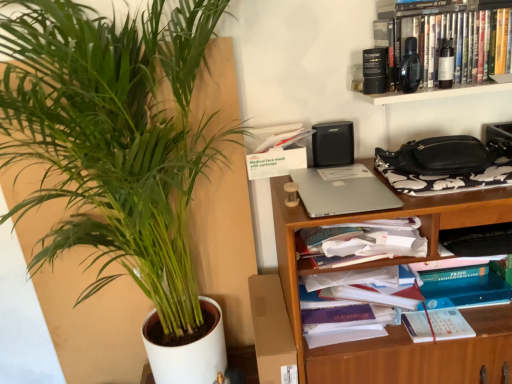
What are the coordinates of `silver metallic laptop at center-right` in the screenshot? It's located at (342, 191).

The width and height of the screenshot is (512, 384). Find the location of `green leafy plant at left`. green leafy plant at left is located at coordinates (114, 140).

At what (x,y) coordinates should I click in order to perform the action: click on black matte speaker at upper right. Please return your answer as a coordinate pair (x, y). Looking at the image, I should click on (333, 144).

From the image's perspective, relative to black plastic shelf at upper right, placed as the second shelf when sorted from bottom to top, is green leafy plant at left above or below?

green leafy plant at left is below black plastic shelf at upper right, placed as the second shelf when sorted from bottom to top.

How many degrees apart are the facing directions of green leafy plant at left and black plastic shelf at upper right, acting as the 1th shelf starting from the top?

There is a 5.04-degree angle between the facing directions of green leafy plant at left and black plastic shelf at upper right, acting as the 1th shelf starting from the top.

Is the depth of green leafy plant at left greater than that of black plastic shelf at upper right, acting as the 1th shelf starting from the top?

Yes, green leafy plant at left is behind black plastic shelf at upper right, acting as the 1th shelf starting from the top.

Based on the photo, between green leafy plant at left and black plastic shelf at upper right, placed as the second shelf when sorted from bottom to top, which one has less height?

black plastic shelf at upper right, placed as the second shelf when sorted from bottom to top.

Based on the photo, would you say black matte speaker at upper right is outside black plastic shelf at upper right, placed as the second shelf when sorted from bottom to top?

Absolutely, black matte speaker at upper right is external to black plastic shelf at upper right, placed as the second shelf when sorted from bottom to top.

From a real-world perspective, who is located lower, black matte speaker at upper right or black plastic shelf at upper right, acting as the 1th shelf starting from the top?

From a 3D spatial view, black matte speaker at upper right is below.

Who is shorter, black matte speaker at upper right or black plastic shelf at upper right, acting as the 1th shelf starting from the top?

Standing shorter between the two is black matte speaker at upper right.

Considering the sizes of objects black matte speaker at upper right and black plastic shelf at upper right, acting as the 1th shelf starting from the top, in the image provided, who is wider, black matte speaker at upper right or black plastic shelf at upper right, acting as the 1th shelf starting from the top,?

black plastic shelf at upper right, acting as the 1th shelf starting from the top.

Which is behind, black plastic shelf at upper right, placed as the second shelf when sorted from bottom to top, or green leafy plant at left?

green leafy plant at left.

Does black plastic shelf at upper right, placed as the second shelf when sorted from bottom to top, have a smaller size compared to green leafy plant at left?

Indeed, black plastic shelf at upper right, placed as the second shelf when sorted from bottom to top, has a smaller size compared to green leafy plant at left.

Is black plastic shelf at upper right, placed as the second shelf when sorted from bottom to top, completely or partially outside of green leafy plant at left?

Yes, black plastic shelf at upper right, placed as the second shelf when sorted from bottom to top, is outside of green leafy plant at left.

In the scene shown: Which object is positioned more to the left, black plastic shelf at upper right, acting as the 1th shelf starting from the top, or green leafy plant at left?

green leafy plant at left.

Is green leafy plant at left oriented towards silver metallic laptop at center-right?

No, green leafy plant at left is not aimed at silver metallic laptop at center-right.

From a real-world perspective, which is physically above, green leafy plant at left or silver metallic laptop at center-right?

From a 3D spatial view, silver metallic laptop at center-right is above.

Which object is wider, green leafy plant at left or silver metallic laptop at center-right?

silver metallic laptop at center-right is wider.

Measure the distance between green leafy plant at left and silver metallic laptop at center-right.

The distance of green leafy plant at left from silver metallic laptop at center-right is 20.48 inches.

From a real-world perspective, which is physically below, black matte speaker at upper right or wooden bookshelf at center-right, the 1th shelf in the bottom-to-top sequence?

wooden bookshelf at center-right, the 1th shelf in the bottom-to-top sequence, from a real-world perspective.

Considering the sizes of objects black matte speaker at upper right and wooden bookshelf at center-right, marked as the second shelf in a top-to-bottom arrangement, in the image provided, who is taller, black matte speaker at upper right or wooden bookshelf at center-right, marked as the second shelf in a top-to-bottom arrangement,?

wooden bookshelf at center-right, marked as the second shelf in a top-to-bottom arrangement, is taller.

The height and width of the screenshot is (384, 512). In order to click on speaker above the green leafy plant at left (from a real-world perspective) in this screenshot , I will do `click(333, 144)`.

From a real-world perspective, who is located lower, black matte speaker at upper right or green leafy plant at left?

green leafy plant at left, from a real-world perspective.

Is black matte speaker at upper right wider or thinner than green leafy plant at left?

Clearly, black matte speaker at upper right has less width compared to green leafy plant at left.

Considering the sizes of black matte speaker at upper right and green leafy plant at left in the image, is black matte speaker at upper right taller or shorter than green leafy plant at left?

Considering their sizes, black matte speaker at upper right has less height than green leafy plant at left.

How far apart are wooden bookshelf at center-right, marked as the second shelf in a top-to-bottom arrangement, and black matte speaker at upper right?

wooden bookshelf at center-right, marked as the second shelf in a top-to-bottom arrangement, is 37.59 centimeters away from black matte speaker at upper right.

Consider the image. Are wooden bookshelf at center-right, the 1th shelf in the bottom-to-top sequence, and black matte speaker at upper right making contact?

No.

You are a GUI agent. You are given a task and a screenshot of the screen. Output one action in this format:
    pyautogui.click(x=<x>, y=<y>)
    Task: Click on the speaker on the left of wooden bookshelf at center-right, marked as the second shelf in a top-to-bottom arrangement
    
    Given the screenshot: What is the action you would take?
    click(333, 144)

Who is bigger, wooden bookshelf at center-right, the 1th shelf in the bottom-to-top sequence, or black matte speaker at upper right?

Bigger between the two is wooden bookshelf at center-right, the 1th shelf in the bottom-to-top sequence.

Find the location of `shelf located above the green leafy plant at left (from a real-world perspective)`. shelf located above the green leafy plant at left (from a real-world perspective) is located at coordinates (457, 51).

Where is `shelf that is the 2nd object to the right of the black matte speaker at upper right, starting at the anchor`? shelf that is the 2nd object to the right of the black matte speaker at upper right, starting at the anchor is located at coordinates (457, 51).

From the image, which object appears to be nearer to green leafy plant at left, silver metallic laptop at center-right or black plastic shelf at upper right, acting as the 1th shelf starting from the top?

silver metallic laptop at center-right.

When comparing their distances from black plastic shelf at upper right, placed as the second shelf when sorted from bottom to top, does silver metallic laptop at center-right or wooden bookshelf at center-right, marked as the second shelf in a top-to-bottom arrangement, seem further?

Based on the image, wooden bookshelf at center-right, marked as the second shelf in a top-to-bottom arrangement, appears to be further to black plastic shelf at upper right, placed as the second shelf when sorted from bottom to top.

Looking at the image, which one is located closer to silver metallic laptop at center-right, wooden bookshelf at center-right, the 1th shelf in the bottom-to-top sequence, or black plastic shelf at upper right, acting as the 1th shelf starting from the top?

Among the two, wooden bookshelf at center-right, the 1th shelf in the bottom-to-top sequence, is located nearer to silver metallic laptop at center-right.

When comparing their distances from green leafy plant at left, does silver metallic laptop at center-right or wooden bookshelf at center-right, marked as the second shelf in a top-to-bottom arrangement, seem further?

Among the two, silver metallic laptop at center-right is located further to green leafy plant at left.

Considering their positions, is green leafy plant at left positioned closer to wooden bookshelf at center-right, the 1th shelf in the bottom-to-top sequence, than silver metallic laptop at center-right?

Among the two, silver metallic laptop at center-right is located nearer to wooden bookshelf at center-right, the 1th shelf in the bottom-to-top sequence.

Estimate the real-world distances between objects in this image. Which object is closer to silver metallic laptop at center-right, black plastic shelf at upper right, acting as the 1th shelf starting from the top, or green leafy plant at left?

black plastic shelf at upper right, acting as the 1th shelf starting from the top.

Looking at the image, which one is located closer to black plastic shelf at upper right, acting as the 1th shelf starting from the top, green leafy plant at left or wooden bookshelf at center-right, the 1th shelf in the bottom-to-top sequence?

wooden bookshelf at center-right, the 1th shelf in the bottom-to-top sequence, is closer to black plastic shelf at upper right, acting as the 1th shelf starting from the top.

Consider the image. Based on their spatial positions, is silver metallic laptop at center-right or black matte speaker at upper right closer to wooden bookshelf at center-right, marked as the second shelf in a top-to-bottom arrangement?

Among the two, silver metallic laptop at center-right is located nearer to wooden bookshelf at center-right, marked as the second shelf in a top-to-bottom arrangement.

In order to click on laptop between green leafy plant at left and black plastic shelf at upper right, acting as the 1th shelf starting from the top in this screenshot , I will do `click(342, 191)`.

Where is `laptop between green leafy plant at left and wooden bookshelf at center-right, marked as the second shelf in a top-to-bottom arrangement`? laptop between green leafy plant at left and wooden bookshelf at center-right, marked as the second shelf in a top-to-bottom arrangement is located at coordinates (342, 191).

Image resolution: width=512 pixels, height=384 pixels. Identify the location of speaker between black plastic shelf at upper right, placed as the second shelf when sorted from bottom to top, and wooden bookshelf at center-right, marked as the second shelf in a top-to-bottom arrangement, in the vertical direction. (333, 144).

You are a GUI agent. You are given a task and a screenshot of the screen. Output one action in this format:
    pyautogui.click(x=<x>, y=<y>)
    Task: Click on the laptop between black matte speaker at upper right and wooden bookshelf at center-right, the 1th shelf in the bottom-to-top sequence, in the vertical direction
    
    Given the screenshot: What is the action you would take?
    pyautogui.click(x=342, y=191)